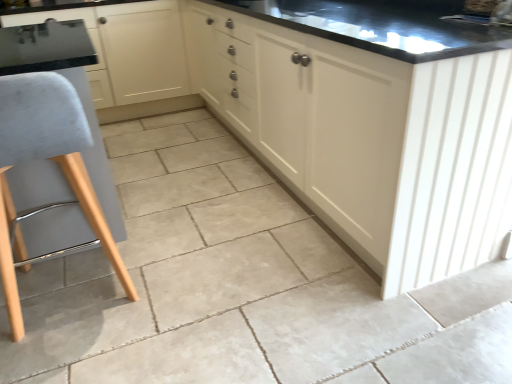
Question: Is matte cream cabinet at center, which ranks as the 2th cabinetry in left-to-right order, at the right side of light gray fabric stool at left?

Choices:
 (A) no
 (B) yes

Answer: (B)

Question: Does matte cream cabinet at center, which ranks as the 2th cabinetry in left-to-right order, have a larger size compared to light gray fabric stool at left?

Choices:
 (A) no
 (B) yes

Answer: (B)

Question: Does matte cream cabinet at center, arranged as the 1th cabinetry when viewed from the right, have a lesser width compared to light gray fabric stool at left?

Choices:
 (A) no
 (B) yes

Answer: (A)

Question: From a real-world perspective, is matte cream cabinet at center, which ranks as the 2th cabinetry in left-to-right order, on top of light gray fabric stool at left?

Choices:
 (A) yes
 (B) no

Answer: (A)

Question: Is matte cream cabinet at center, arranged as the 1th cabinetry when viewed from the right, positioned far away from light gray fabric stool at left?

Choices:
 (A) yes
 (B) no

Answer: (B)

Question: Choose the correct answer: Is matte cream cabinet at center, which ranks as the 2th cabinetry in left-to-right order, inside matte black sink at upper center or outside it?

Choices:
 (A) outside
 (B) inside

Answer: (A)

Question: From a real-world perspective, is matte cream cabinet at center, which ranks as the 2th cabinetry in left-to-right order, above or below matte black sink at upper center?

Choices:
 (A) below
 (B) above

Answer: (A)

Question: In the image, is matte cream cabinet at center, which ranks as the 2th cabinetry in left-to-right order, positioned in front of or behind matte black sink at upper center?

Choices:
 (A) front
 (B) behind

Answer: (A)

Question: In terms of height, does matte cream cabinet at center, which ranks as the 2th cabinetry in left-to-right order, look taller or shorter compared to matte black sink at upper center?

Choices:
 (A) short
 (B) tall

Answer: (B)

Question: Considering the positions of matte cream cabinet at center, arranged as the 1th cabinetry when viewed from the right, and matte white cabinet at center, which ranks as the 2th cabinetry in right-to-left order, in the image, is matte cream cabinet at center, arranged as the 1th cabinetry when viewed from the right, taller or shorter than matte white cabinet at center, which ranks as the 2th cabinetry in right-to-left order,?

Choices:
 (A) short
 (B) tall

Answer: (B)

Question: Considering the relative positions of matte cream cabinet at center, arranged as the 1th cabinetry when viewed from the right, and matte white cabinet at center, which ranks as the 2th cabinetry in right-to-left order, in the image provided, is matte cream cabinet at center, arranged as the 1th cabinetry when viewed from the right, to the left or to the right of matte white cabinet at center, which ranks as the 2th cabinetry in right-to-left order,?

Choices:
 (A) right
 (B) left

Answer: (A)

Question: Looking at their shapes, would you say matte cream cabinet at center, arranged as the 1th cabinetry when viewed from the right, is wider or thinner than matte white cabinet at center, which ranks as the 2th cabinetry in right-to-left order?

Choices:
 (A) wide
 (B) thin

Answer: (A)

Question: From a real-world perspective, is matte cream cabinet at center, arranged as the 1th cabinetry when viewed from the right, physically located above or below matte white cabinet at center, the 1th cabinetry viewed from the left?

Choices:
 (A) below
 (B) above

Answer: (B)

Question: Which is correct: matte black sink at upper center is inside matte cream cabinet at center, which ranks as the 2th cabinetry in left-to-right order, or outside of it?

Choices:
 (A) outside
 (B) inside

Answer: (B)

Question: Is matte black sink at upper center wider or thinner than matte cream cabinet at center, arranged as the 1th cabinetry when viewed from the right?

Choices:
 (A) wide
 (B) thin

Answer: (B)